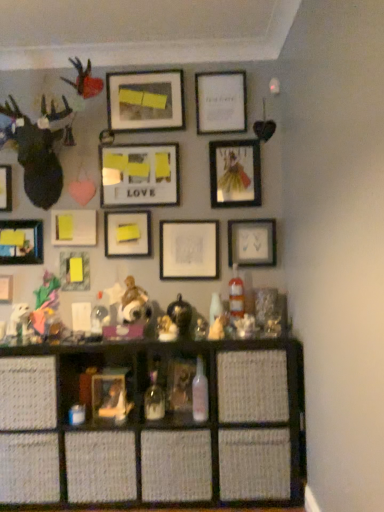
Question: Is white paper at center, the fourth picture frame positioned from the right, further to the viewer compared to white paper at upper center, acting as the 3th picture frame starting from the right?

Choices:
 (A) yes
 (B) no

Answer: (A)

Question: Is white paper at center, arranged as the 9th picture frame when viewed from the left, not inside white paper at upper center, acting as the 3th picture frame starting from the right?

Choices:
 (A) yes
 (B) no

Answer: (A)

Question: From a real-world perspective, is white paper at center, arranged as the 9th picture frame when viewed from the left, below white paper at upper center, the 10th picture frame positioned from the left?

Choices:
 (A) yes
 (B) no

Answer: (A)

Question: Can you confirm if white paper at center, arranged as the 9th picture frame when viewed from the left, is shorter than white paper at upper center, acting as the 3th picture frame starting from the right?

Choices:
 (A) no
 (B) yes

Answer: (B)

Question: Considering the relative sizes of white paper at center, arranged as the 9th picture frame when viewed from the left, and white paper at upper center, acting as the 3th picture frame starting from the right, in the image provided, is white paper at center, arranged as the 9th picture frame when viewed from the left, wider than white paper at upper center, acting as the 3th picture frame starting from the right,?

Choices:
 (A) yes
 (B) no

Answer: (B)

Question: Does white paper at center, arranged as the 9th picture frame when viewed from the left, turn towards white paper at upper center, the 10th picture frame positioned from the left?

Choices:
 (A) yes
 (B) no

Answer: (B)

Question: Is woven wood shelf at lower center not inside matte glass picture frame at center-right, which appears as the 1th picture frame when viewed from the right?

Choices:
 (A) yes
 (B) no

Answer: (A)

Question: Would you say woven wood shelf at lower center is a long distance from matte glass picture frame at center-right, the twelfth picture frame viewed from the left?

Choices:
 (A) no
 (B) yes

Answer: (A)

Question: Is woven wood shelf at lower center taller than matte glass picture frame at center-right, which appears as the 1th picture frame when viewed from the right?

Choices:
 (A) no
 (B) yes

Answer: (B)

Question: Does woven wood shelf at lower center turn towards matte glass picture frame at center-right, which appears as the 1th picture frame when viewed from the right?

Choices:
 (A) no
 (B) yes

Answer: (A)

Question: Is matte glass picture frame at center-right, the twelfth picture frame viewed from the left, at the back of woven wood shelf at lower center?

Choices:
 (A) yes
 (B) no

Answer: (B)

Question: Is woven wood shelf at lower center positioned before matte glass picture frame at center-right, which appears as the 1th picture frame when viewed from the right?

Choices:
 (A) no
 (B) yes

Answer: (B)

Question: Is white paper at upper center, the 10th picture frame positioned from the left, shorter than matte black picture frame at upper center, the eighth picture frame in the left-to-right sequence?

Choices:
 (A) no
 (B) yes

Answer: (A)